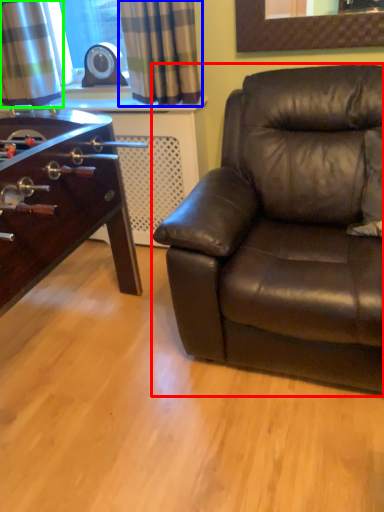
Question: Which object is the farthest from studio couch (highlighted by a red box)? Choose among these: curtain (highlighted by a blue box) or curtain (highlighted by a green box).

Choices:
 (A) curtain
 (B) curtain

Answer: (B)